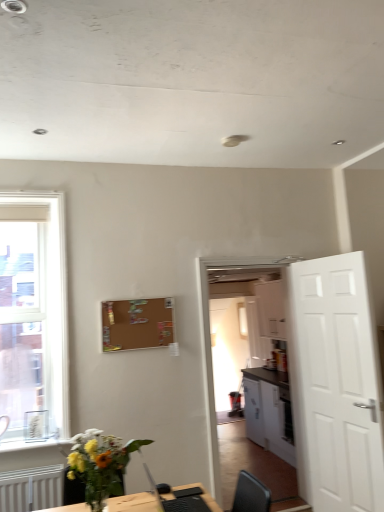
Identify the location of free spot above white glossy window sill at lower left (from a real-world perspective). Image resolution: width=384 pixels, height=512 pixels. (39, 437).